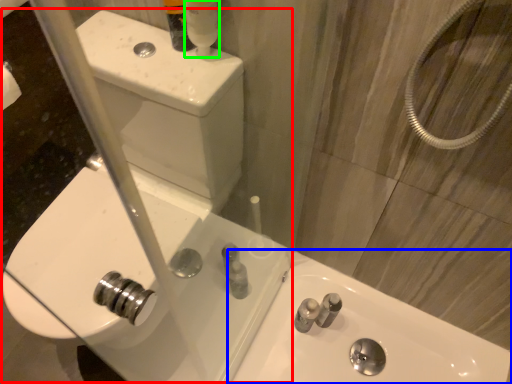
Question: Considering the real-world distances, which object is farthest from sink (highlighted by a red box)? sink (highlighted by a blue box) or mouthwash (highlighted by a green box)?

Choices:
 (A) sink
 (B) mouthwash

Answer: (B)